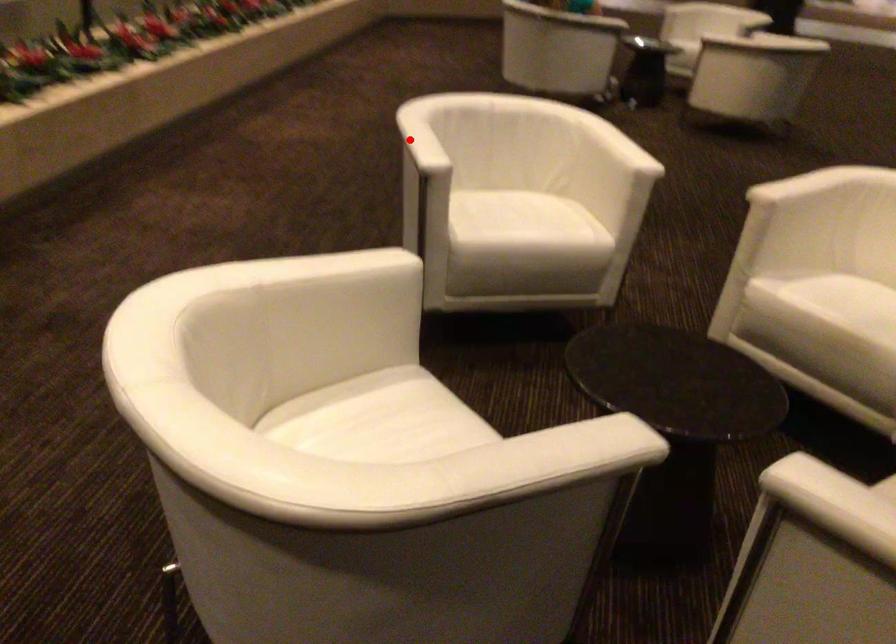
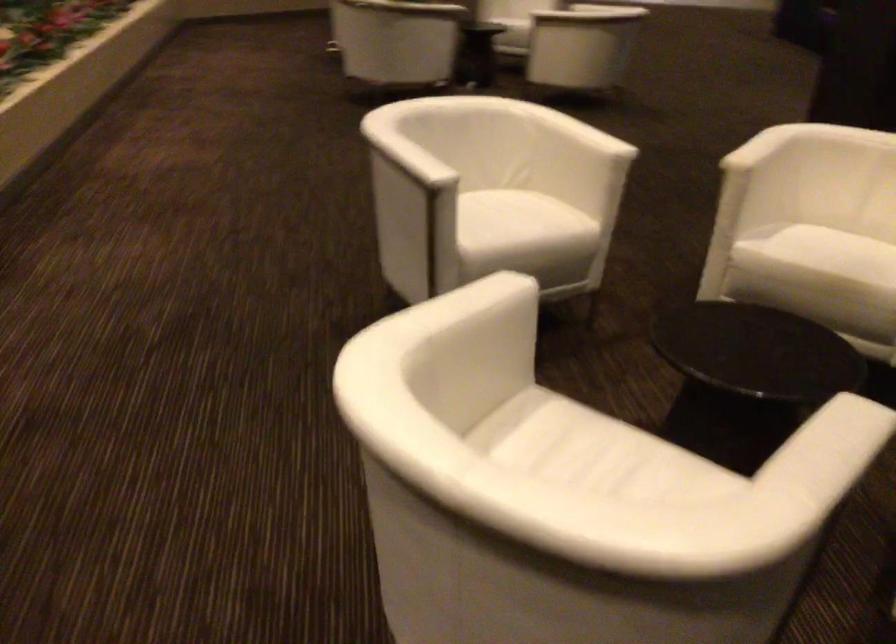
Question: I am providing you with two images of the same scene from different viewpoints. A red point is marked on the first image. At the location where the point appears in image 1, is it still visible in image 2?

Choices:
 (A) Yes
 (B) No

Answer: (A)